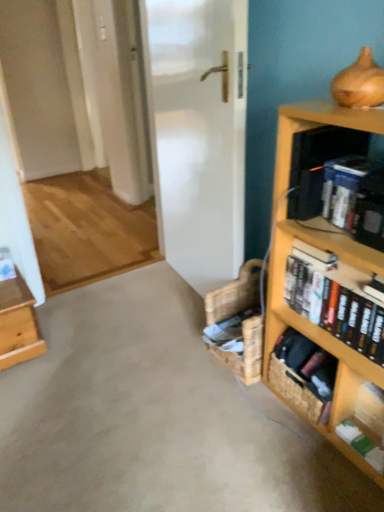
Question: From their relative heights in the image, would you say black plastic shelf at upper right is taller or shorter than blue hardcover book at upper right, which ranks as the 3th book in bottom-to-top order?

Choices:
 (A) tall
 (B) short

Answer: (A)

Question: Considering their positions, is black plastic shelf at upper right located in front of or behind blue hardcover book at upper right, which ranks as the 3th book in bottom-to-top order?

Choices:
 (A) front
 (B) behind

Answer: (B)

Question: Estimate the real-world distances between objects in this image. Which object is farther from the green matte book at lower right, which is the 1th book in bottom-to-top order?

Choices:
 (A) wooden bookcase at right
 (B) woven brown basket at lower right
 (C) hardcover books at right, the 2th book from the bottom
 (D) light brown wooden table at left
 (E) black plastic shelf at upper right

Answer: (D)

Question: Which object is the farthest from the smooth concrete floor at center?

Choices:
 (A) light brown wooden table at left
 (B) woven brown basket at lower right
 (C) blue hardcover book at upper right, which ranks as the 3th book in bottom-to-top order
 (D) black plastic shelf at upper right
 (E) green matte book at lower right, placed as the third book when sorted from top to bottom

Answer: (C)